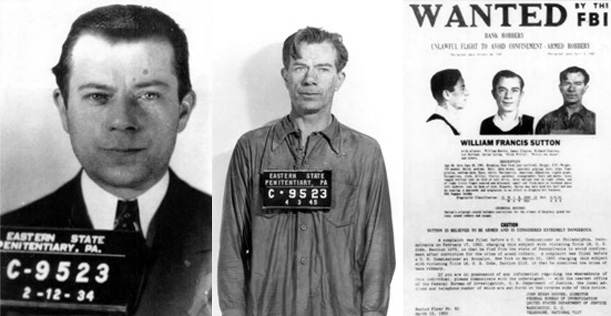
Find the location of `right eye of leftmost portrait`. right eye of leftmost portrait is located at coordinates (98, 99).